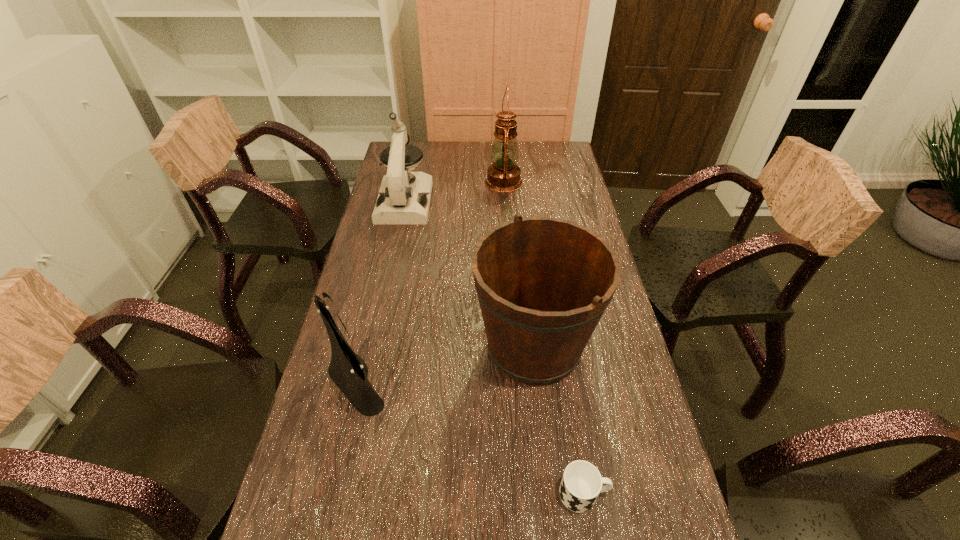
This screenshot has height=540, width=960. I want to click on oil lamp, so click(x=504, y=175).

Find the location of a particular element. microscope is located at coordinates (404, 197).

Where is `bucket`? bucket is located at coordinates (543, 284).

Image resolution: width=960 pixels, height=540 pixels. In order to click on shoulder bag in this screenshot , I will do `click(361, 394)`.

At what (x,y) coordinates should I click in order to perform the action: click on cup. Please return your answer as a coordinate pair (x, y). The width and height of the screenshot is (960, 540). Looking at the image, I should click on (581, 483).

Identify the location of the nearest object. This screenshot has width=960, height=540. (581, 483).

At what (x,y) coordinates should I click in order to perform the action: click on vacant space situated 0.320m on the left of the oil lamp. Please return your answer as a coordinate pair (x, y). Image resolution: width=960 pixels, height=540 pixels. Looking at the image, I should click on (405, 182).

This screenshot has height=540, width=960. Find the location of `vacant space situated 0.230m at the eyepiece of the microscope`. vacant space situated 0.230m at the eyepiece of the microscope is located at coordinates (391, 268).

Find the location of a particular element. blank space located 0.340m on the back of the bucket is located at coordinates (521, 232).

Locate an element on the screen. vacant space located 0.170m on the front of the shoulder bag is located at coordinates (326, 503).